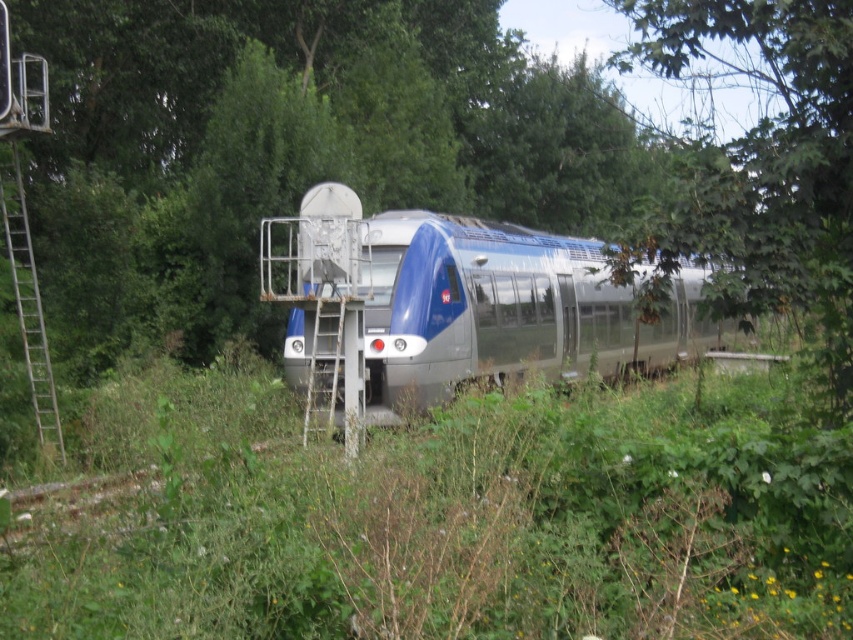
Question: Which point is farther from the camera taking this photo?

Choices:
 (A) coord(544,456)
 (B) coord(33,392)

Answer: (B)

Question: Is green grass at center behind metallic blue train at center?

Choices:
 (A) no
 (B) yes

Answer: (A)

Question: Which point is closer to the camera taking this photo?

Choices:
 (A) (4, 236)
 (B) (154, 625)

Answer: (B)

Question: Is green grass at center thinner than metallic silver ladder at left?

Choices:
 (A) no
 (B) yes

Answer: (A)

Question: Among these points, which one is farthest from the camera?

Choices:
 (A) (67, 524)
 (B) (408, 388)
 (C) (25, 320)

Answer: (C)

Question: Does green grass at center appear under metallic blue train at center?

Choices:
 (A) yes
 (B) no

Answer: (A)